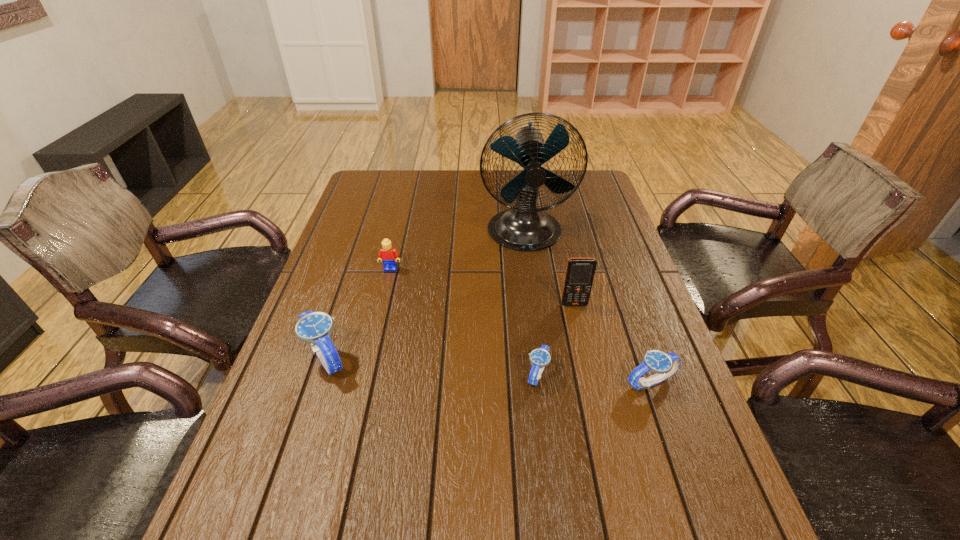
Where is `free spot between the fifth nearest object and the rightmost object`? This screenshot has width=960, height=540. free spot between the fifth nearest object and the rightmost object is located at coordinates (520, 326).

You are a GUI agent. You are given a task and a screenshot of the screen. Output one action in this format:
    pyautogui.click(x=<x>, y=<y>)
    Task: Click on the free spot between the fifth nearest object and the farthest object
    
    Given the screenshot: What is the action you would take?
    pyautogui.click(x=458, y=251)

Identify the location of free area in between the farthest object and the fourth nearest object. Image resolution: width=960 pixels, height=540 pixels. (550, 269).

You are a GUI agent. You are given a task and a screenshot of the screen. Output one action in this format:
    pyautogui.click(x=<x>, y=<y>)
    Task: Click on the free space between the second watch from right to left and the rightmost watch
    
    Given the screenshot: What is the action you would take?
    pyautogui.click(x=594, y=378)

Identify the location of free area in between the second shortest watch and the fourth nearest object. (612, 343).

I want to click on vacant region between the fifth shortest object and the second object from left to right, so click(483, 287).

The image size is (960, 540). I want to click on free space between the shortest object and the tallest watch, so click(432, 366).

Find the location of a particular element. free space between the tallest object and the fifth shortest object is located at coordinates (550, 269).

Locate which object is the fifth closest to the leftmost watch. Please provide its 2D coordinates. Your answer should be formatted as a tuple, i.e. [(x, y)], where the tuple contains the x and y coordinates of a point satisfying the conditions above.

[(664, 364)]

The width and height of the screenshot is (960, 540). In order to click on object identified as the fourth closest to the fourth nearest object in this screenshot , I will do `click(389, 255)`.